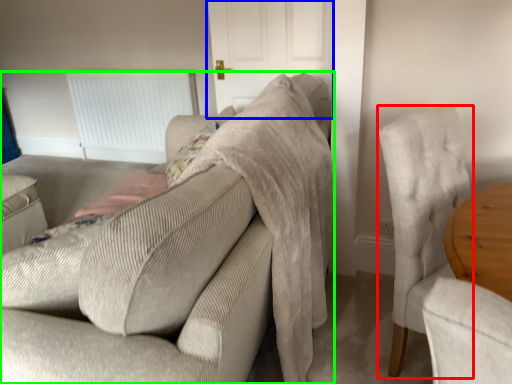
Question: Estimate the real-world distances between objects in this image. Which object is farther from chair (highlighted by a red box), door (highlighted by a blue box) or studio couch (highlighted by a green box)?

Choices:
 (A) door
 (B) studio couch

Answer: (A)